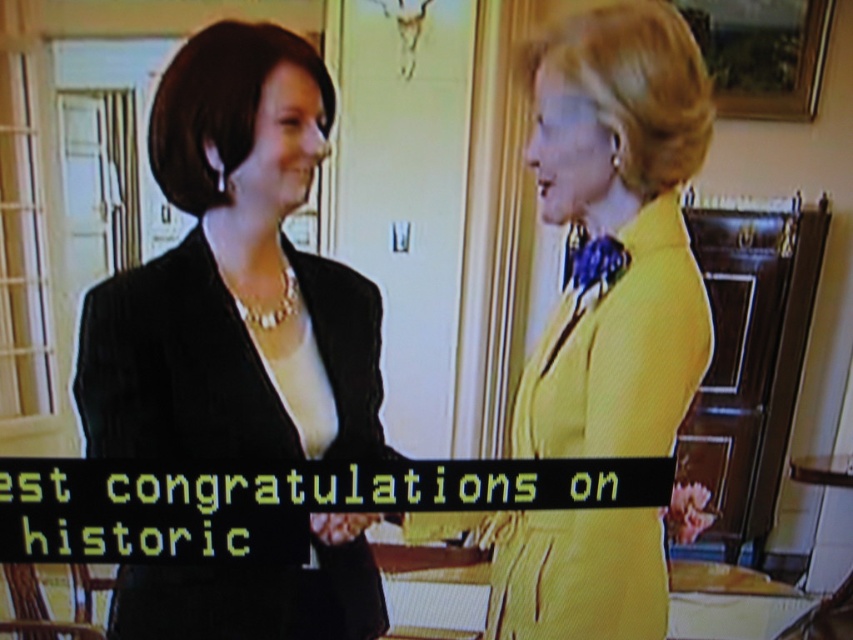
You are a fashion designer observing two outfits in the scene. The first is the matte black blazer at center, and the second is the yellow textured dress at right. Which outfit takes up more space in the image?

The matte black blazer at center has a larger size compared to the yellow textured dress at right, so it takes up more space in the image.

You are an assistant analyzing the image. The scene shows two women in an official setting. Where is the matte black blazer at center located in terms of coordinates?

The matte black blazer at center is located at coordinates point (x=234, y=276).